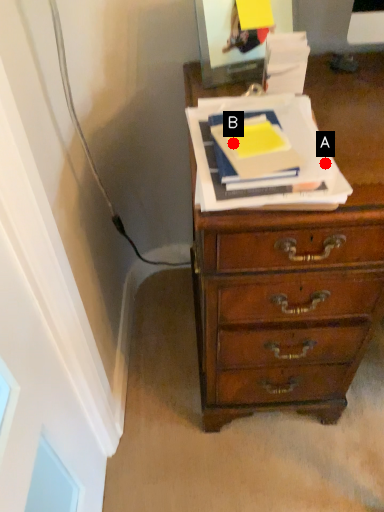
Question: Two points are circled on the image, labeled by A and B beside each circle. Which point is further to the camera?

Choices:
 (A) A is further
 (B) B is further

Answer: (B)